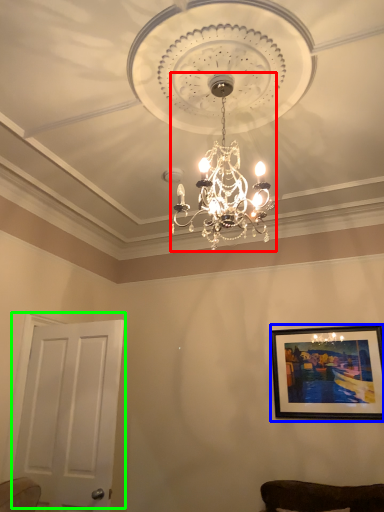
Question: Which is nearer to the lamp (highlighted by a red box)? picture frame (highlighted by a blue box) or door (highlighted by a green box).

Choices:
 (A) picture frame
 (B) door

Answer: (B)